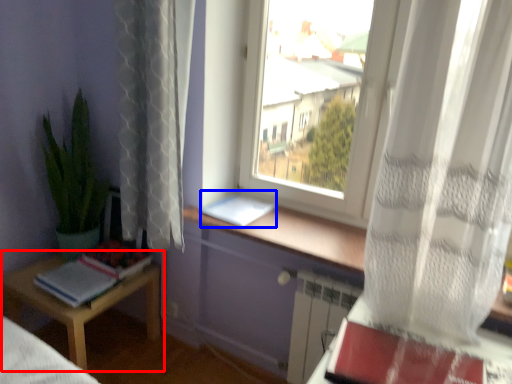
Question: Which point is closer to the camera, table (highlighted by a red box) or paperback book (highlighted by a blue box)?

Choices:
 (A) table
 (B) paperback book

Answer: (A)